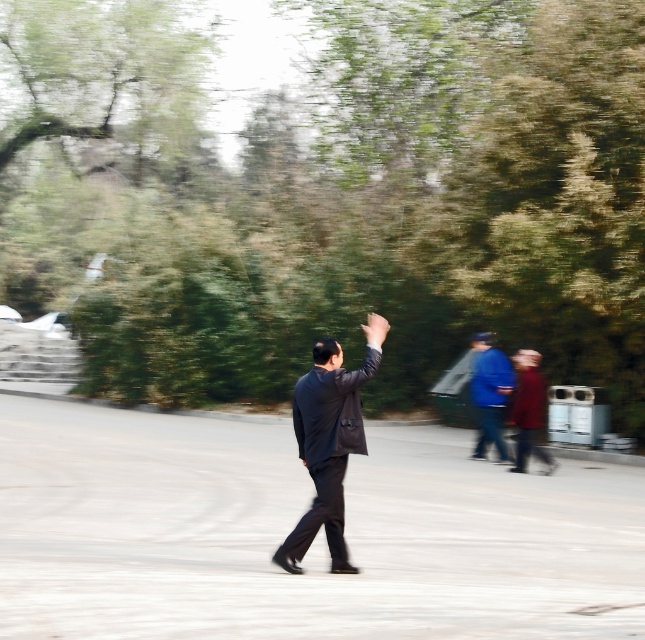
You are standing at the origin point of the image. Where is the dark blue suit at center located in terms of coordinates?

The dark blue suit at center is located at coordinates point (328,442).